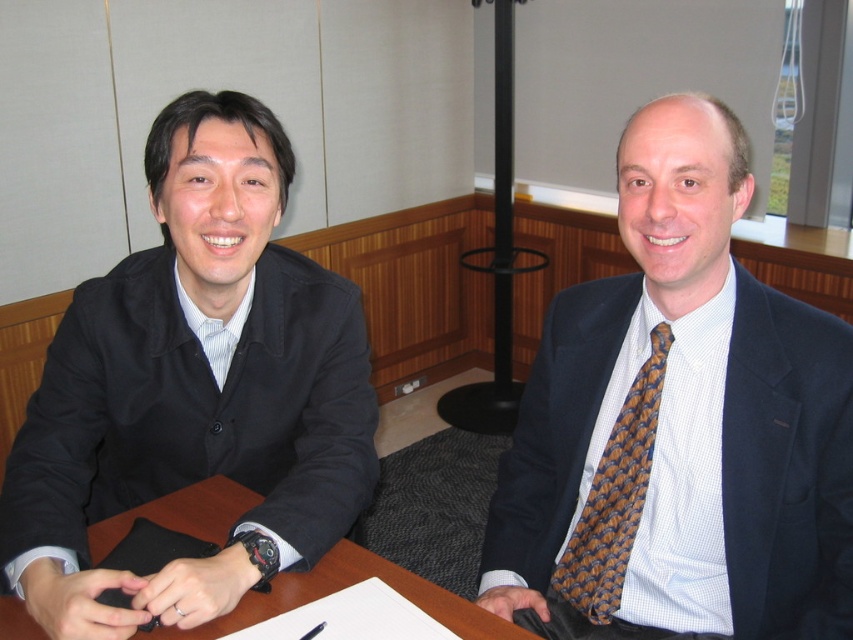
Does blue textured suit at center appear over brown woven tie at right?

Correct, blue textured suit at center is located above brown woven tie at right.

Is blue textured suit at center positioned before brown woven tie at right?

Yes.

Which is in front, point (613, 426) or point (624, 401)?

Point (624, 401) is more forward.

Locate an element on the screen. The image size is (853, 640). blue textured suit at center is located at coordinates (686, 413).

From the picture: Who is shorter, black matte suit at left or brown woven tie at right?

With less height is brown woven tie at right.

Which is more to the left, black matte suit at left or brown woven tie at right?

From the viewer's perspective, black matte suit at left appears more on the left side.

Identify the location of black matte suit at left. This screenshot has width=853, height=640. (194, 388).

Can you confirm if blue textured suit at center is bigger than brown wooden table at center?

Yes, blue textured suit at center is bigger than brown wooden table at center.

In the scene shown: Is blue textured suit at center wider than brown wooden table at center?

In fact, blue textured suit at center might be narrower than brown wooden table at center.

Which is behind, point (793, 388) or point (196, 522)?

The point (196, 522) is behind.

You are a GUI agent. You are given a task and a screenshot of the screen. Output one action in this format:
    pyautogui.click(x=<x>, y=<y>)
    Task: Click on the blue textured suit at center
    
    Given the screenshot: What is the action you would take?
    pyautogui.click(x=686, y=413)